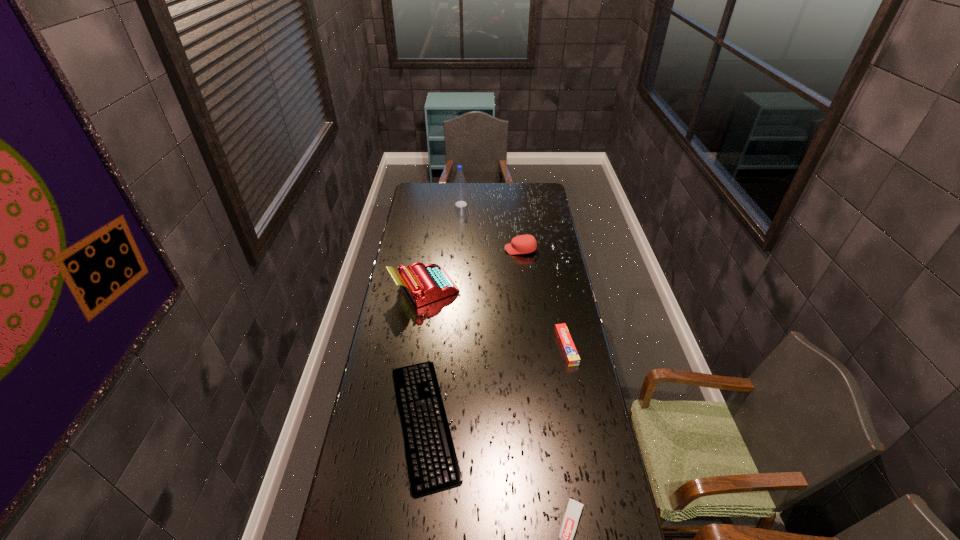
Locate an element on the screen. Image resolution: width=960 pixels, height=540 pixels. vacant region located on the typing side of the typewriter is located at coordinates (530, 289).

The width and height of the screenshot is (960, 540). What are the coordinates of `vacant area situated 0.320m on the front-facing side of the fourth shortest object` in the screenshot? It's located at (441, 249).

Find the location of a particular element. The width and height of the screenshot is (960, 540). vacant point located on the front-facing side of the fourth shortest object is located at coordinates (478, 249).

Locate an element on the screen. Image resolution: width=960 pixels, height=540 pixels. vacant space positioned 0.150m on the front-facing side of the fourth shortest object is located at coordinates (474, 249).

Where is `free spot located on the left of the farther toothpaste`? The height and width of the screenshot is (540, 960). free spot located on the left of the farther toothpaste is located at coordinates (468, 347).

The width and height of the screenshot is (960, 540). In order to click on vacant space located on the right of the shortest object in this screenshot , I will do `click(479, 422)`.

Locate an element on the screen. The width and height of the screenshot is (960, 540). object that is positioned at the far edge is located at coordinates (460, 195).

You are a GUI agent. You are given a task and a screenshot of the screen. Output one action in this format:
    pyautogui.click(x=<x>, y=<y>)
    Task: Click on the typewriter located at the left edge
    The width and height of the screenshot is (960, 540).
    Given the screenshot: What is the action you would take?
    pyautogui.click(x=427, y=283)

Identify the location of computer keyboard that is at the left edge. (432, 462).

At what (x,y) coordinates should I click in order to perform the action: click on cap situated at the right edge. Please return your answer as a coordinate pair (x, y). Looking at the image, I should click on (522, 244).